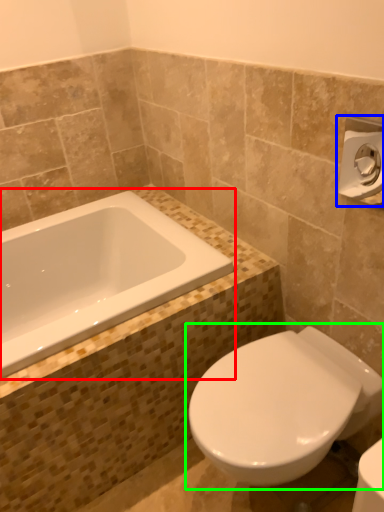
Question: Which object is the farthest from bathtub (highlighted by a red box)? Choose among these: towel bar (highlighted by a blue box) or toilet (highlighted by a green box).

Choices:
 (A) towel bar
 (B) toilet

Answer: (A)